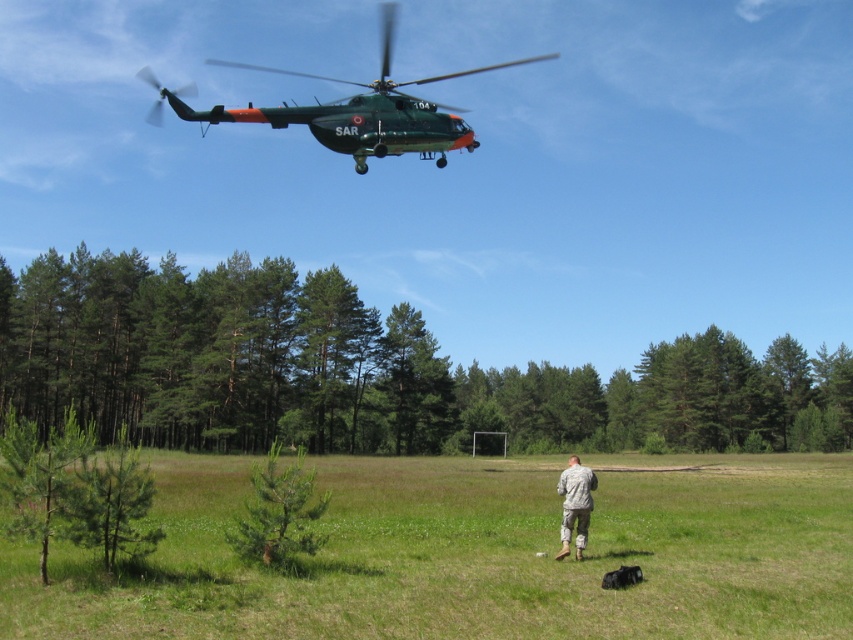
Question: Which point appears closest to the camera in this image?

Choices:
 (A) (700, 531)
 (B) (624, 582)
 (C) (236, 115)
 (D) (578, 548)

Answer: (B)

Question: Is green grass at center below camouflage uniform at center?

Choices:
 (A) no
 (B) yes

Answer: (B)

Question: Which point is farther to the camera?

Choices:
 (A) green grass at center
 (B) camouflage uniform at center

Answer: (B)

Question: From the image, what is the correct spatial relationship of green grass at center in relation to camouflage uniform at center?

Choices:
 (A) below
 (B) above

Answer: (A)

Question: Which object appears closest to the camera in this image?

Choices:
 (A) black fur dog at lower center
 (B) camouflage uniform at center
 (C) green matte helicopter at upper center

Answer: (A)

Question: Is camouflage uniform at center below black fur dog at lower center?

Choices:
 (A) yes
 (B) no

Answer: (A)